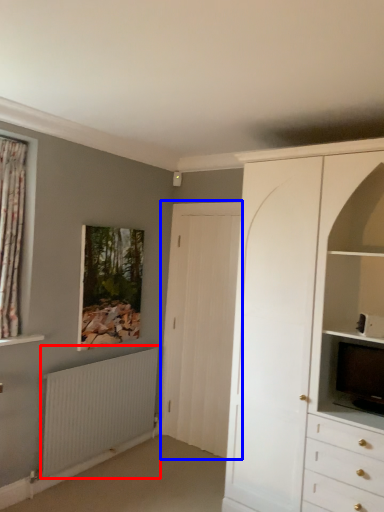
Question: Which object is further to the camera taking this photo, radiator (highlighted by a red box) or door (highlighted by a blue box)?

Choices:
 (A) radiator
 (B) door

Answer: (B)